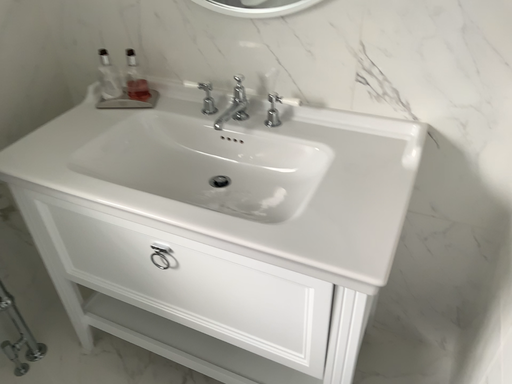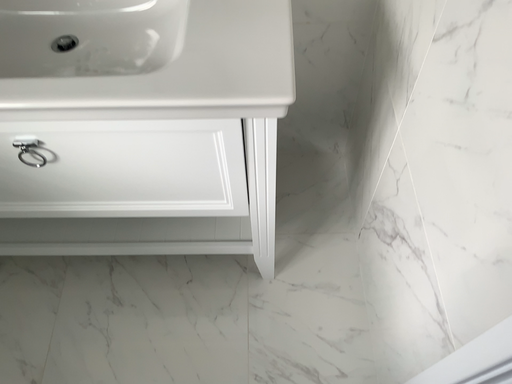
Question: Which way did the camera rotate in the video?

Choices:
 (A) rotated right
 (B) rotated left

Answer: (A)